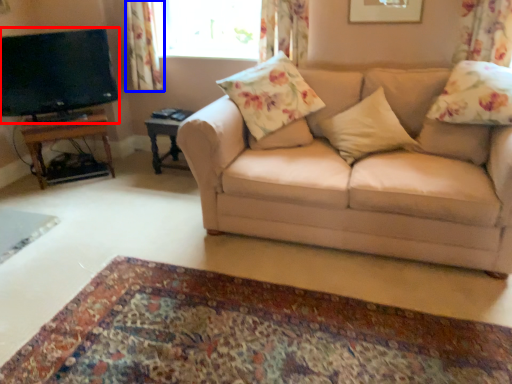
Question: Which object is closer to the camera taking this photo, television (highlighted by a red box) or curtain (highlighted by a blue box)?

Choices:
 (A) television
 (B) curtain

Answer: (A)